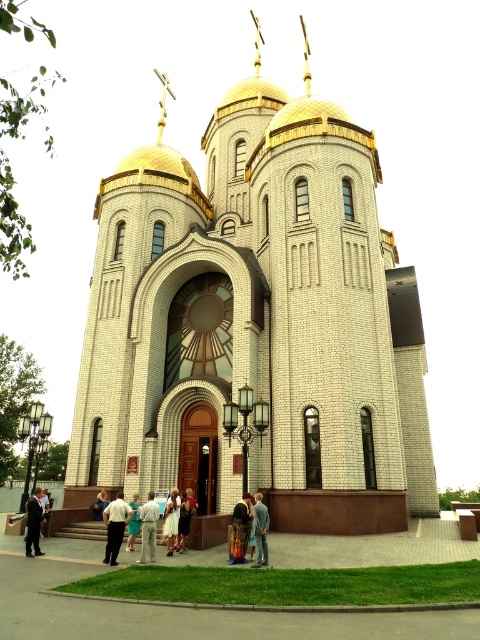
You are standing at the entrance of the grand Eastern Orthodox church and notice a dark suit at lower left. Where exactly is the dark suit positioned relative to the entrance?

The dark suit at lower left is located at point coordinates approximately 0.817 on the x axis and 0.071 on the y axis, which is to the lower left of the entrance.

You are a photographer standing at the entrance of the church. You want to take a photo that includes both the white cotton shirt at center and the white cotton dress at center. The camera you are using has a maximum focus range of 5 meters. Will you be able to capture both subjects in focus without moving your position?

The distance between the white cotton shirt at center and the white cotton dress at center is 5.72 meters. Since the camera can only focus up to 5 meters, it won not be able to capture both subjects in focus at this distance. You might need to move closer or use a different camera setting.

You are attending a wedding at the grand Eastern Orthodox church and see a dark suit at lower left and a white cotton dress at center. Which attendee is standing more to the left side?

The dark suit at lower left is positioned on the left side of the white cotton dress at center, so the attendee in the dark suit at lower left is standing more to the left side.